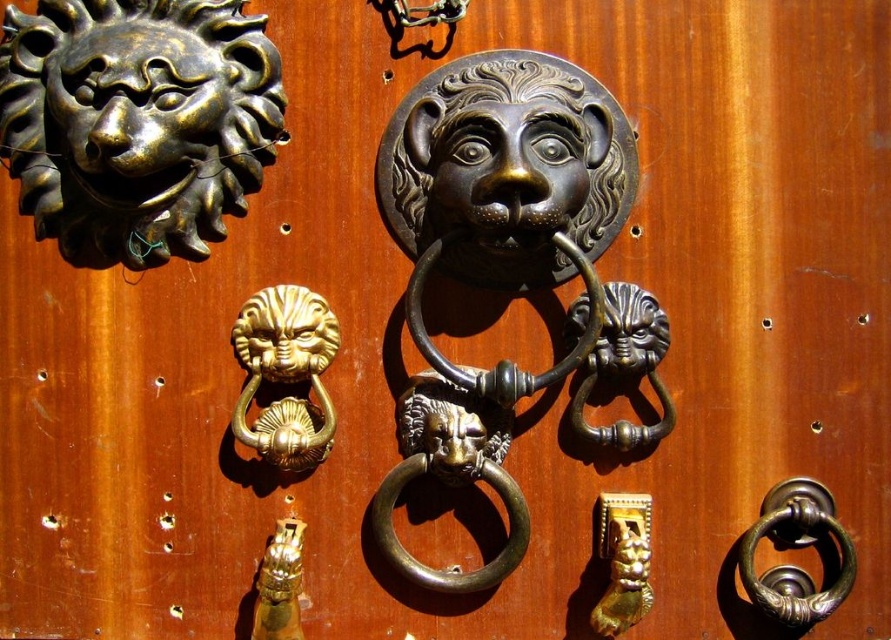
Question: Does brass ring handle at center appear under brass/bronze lion head at center?

Choices:
 (A) yes
 (B) no

Answer: (A)

Question: Is brass ring handle at center to the left of gold polished lion head at lower center from the viewer's perspective?

Choices:
 (A) no
 (B) yes

Answer: (A)

Question: Can you confirm if brass lion head at upper left is wider than polished brass lion head at center?

Choices:
 (A) yes
 (B) no

Answer: (A)

Question: Which is farther from the gold polished lion head at center?

Choices:
 (A) brass ring handle at center
 (B) brass/bronze lion head at center
 (C) brass lion head at upper left

Answer: (B)

Question: Which point is closer to the camera?

Choices:
 (A) gold polished lion head at center
 (B) gold polished lion head at lower center
 (C) brass/bronze lion head at center
 (D) brass ring handle at center

Answer: (B)

Question: Among these objects, which one is nearest to the camera?

Choices:
 (A) polished brass lion head at center
 (B) brass/bronze lion head at center

Answer: (A)